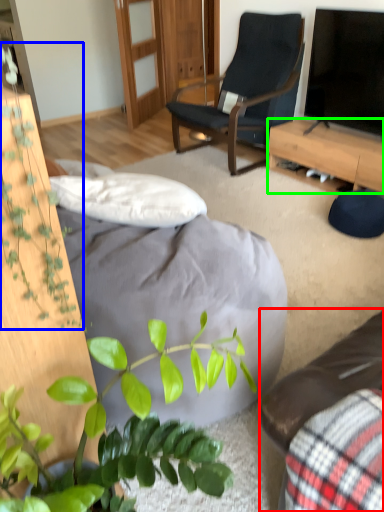
Question: Which object is the closest to the studio couch (highlighted by a red box)? Choose among these: vegetation (highlighted by a blue box) or desk (highlighted by a green box).

Choices:
 (A) vegetation
 (B) desk

Answer: (A)